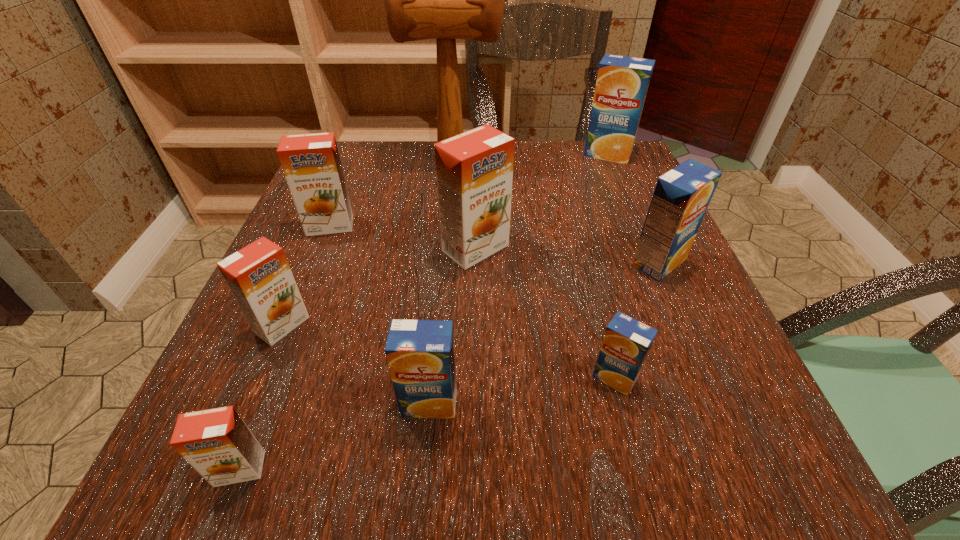
Locate an element on the screen. Image resolution: width=960 pixels, height=540 pixels. the seventh object from left to right is located at coordinates (626, 343).

This screenshot has height=540, width=960. I want to click on the smallest orange orange juice, so click(217, 443).

Image resolution: width=960 pixels, height=540 pixels. I want to click on the nearest orange orange juice, so click(217, 443).

Where is `free spot located 0.170m on the strike surface of the tallest object`? The height and width of the screenshot is (540, 960). free spot located 0.170m on the strike surface of the tallest object is located at coordinates (570, 159).

The height and width of the screenshot is (540, 960). In order to click on vacant space located on the left of the farthest blue orange_juice in this screenshot , I will do `click(501, 154)`.

At what (x,y) coordinates should I click in order to perform the action: click on vacant space located 0.110m on the front of the rightmost orange orange juice. Please return your answer as a coordinate pair (x, y). Image resolution: width=960 pixels, height=540 pixels. Looking at the image, I should click on (475, 318).

What are the coordinates of `vacant space situated 0.110m on the left of the second farthest blue orange_juice` in the screenshot? It's located at (569, 262).

The image size is (960, 540). What are the coordinates of `free point located on the right of the second biggest orange orange juice` in the screenshot? It's located at (556, 225).

The image size is (960, 540). Identify the location of free space located 0.400m on the back of the sixth farthest object. (345, 176).

In order to click on vacant space located 0.210m on the right of the leftmost blue orange_juice in this screenshot , I will do `click(612, 403)`.